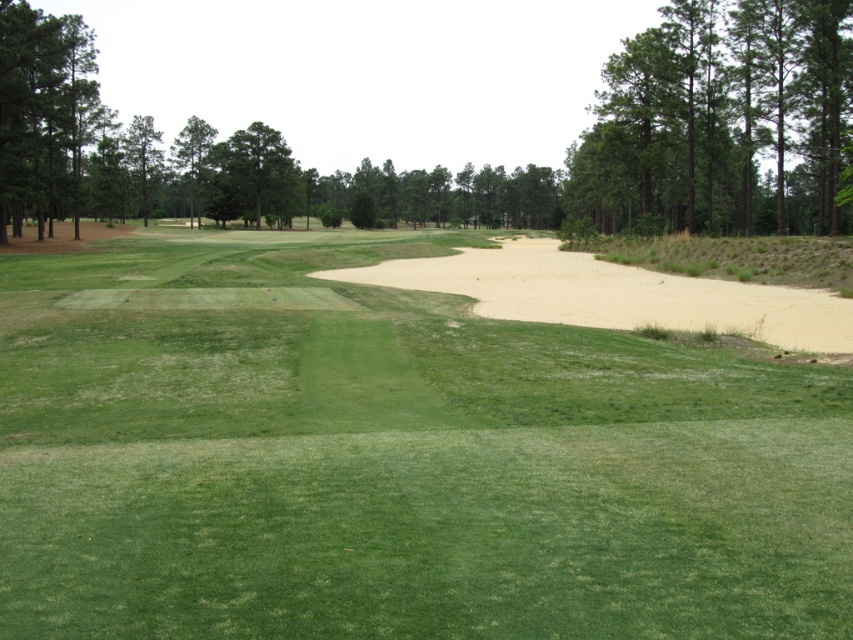
Question: Estimate the real-world distances between objects in this image. Which object is farther from the green leafy tree at upper left?

Choices:
 (A) green leafy tree at upper center
 (B) tan sandy bunker at center
 (C) green leafy tree at upper right

Answer: (B)

Question: Is green grassy fairway at center thinner than green leafy tree at upper left?

Choices:
 (A) no
 (B) yes

Answer: (A)

Question: Can you confirm if green leafy tree at upper right is positioned above green leafy tree at upper left?

Choices:
 (A) no
 (B) yes

Answer: (B)

Question: Which point is farther from the camera taking this photo?

Choices:
 (A) (289, 163)
 (B) (718, 284)
 (C) (221, 337)

Answer: (A)

Question: Can you confirm if green leafy tree at upper center is thinner than green leafy tree at upper left?

Choices:
 (A) no
 (B) yes

Answer: (B)

Question: Estimate the real-world distances between objects in this image. Which object is closer to the green leafy tree at upper right?

Choices:
 (A) green grassy fairway at center
 (B) green leafy tree at upper left
 (C) tan sandy bunker at center
 (D) green leafy tree at upper center

Answer: (C)